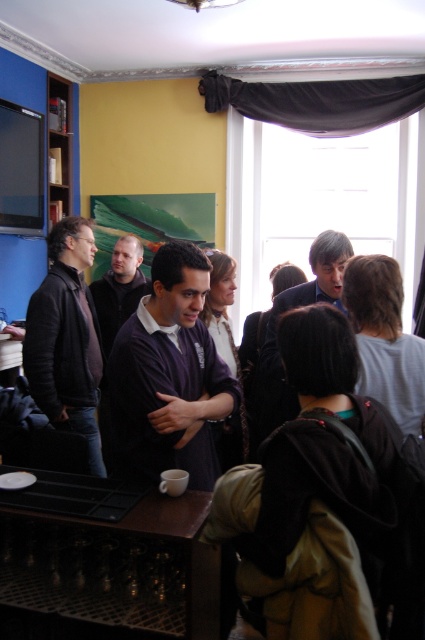
Is dark brown leather jacket at left shorter than matte black shirt at center?

In fact, dark brown leather jacket at left may be taller than matte black shirt at center.

Does dark brown leather jacket at left appear over matte black shirt at center?

Actually, dark brown leather jacket at left is below matte black shirt at center.

The height and width of the screenshot is (640, 425). What are the coordinates of `dark brown leather jacket at left` in the screenshot? It's located at (67, 339).

The height and width of the screenshot is (640, 425). Find the location of `dark brown leather jacket at left`. dark brown leather jacket at left is located at coordinates (67, 339).

Does dark blue suit at center appear under matte black shirt at center?

Yes, dark blue suit at center is below matte black shirt at center.

Which is above, dark blue suit at center or matte black shirt at center?

matte black shirt at center

At what (x,y) coordinates should I click in order to perform the action: click on dark blue suit at center. Please return your answer as a coordinate pair (x, y). Image resolution: width=425 pixels, height=640 pixels. Looking at the image, I should click on [277, 323].

How far apart are dark brown leather jacket at left and dark blue suit at center?

dark brown leather jacket at left is 36.98 inches from dark blue suit at center.

You are a GUI agent. You are given a task and a screenshot of the screen. Output one action in this format:
    pyautogui.click(x=<x>, y=<y>)
    Task: Click on the dark brown leather jacket at left
    This screenshot has width=425, height=640.
    Given the screenshot: What is the action you would take?
    pyautogui.click(x=67, y=339)